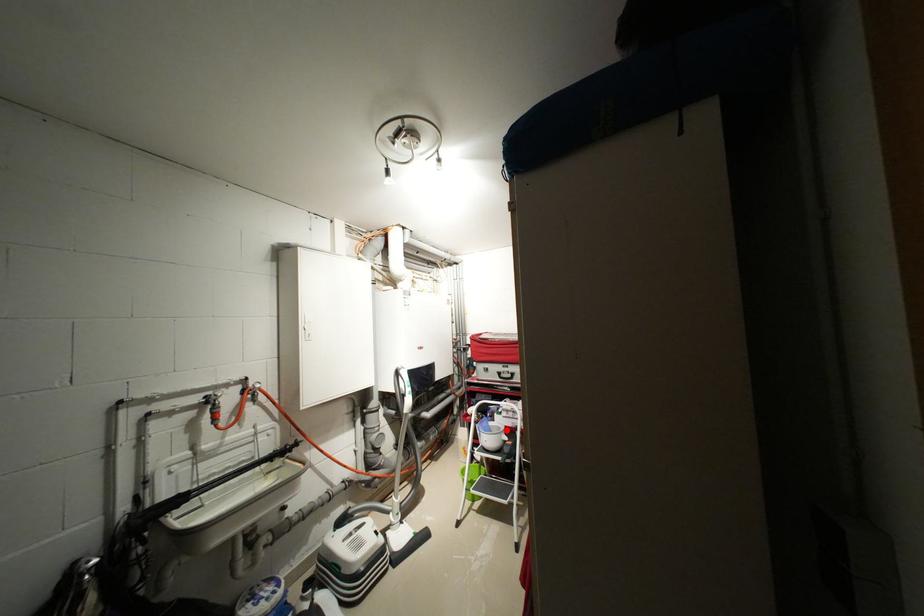
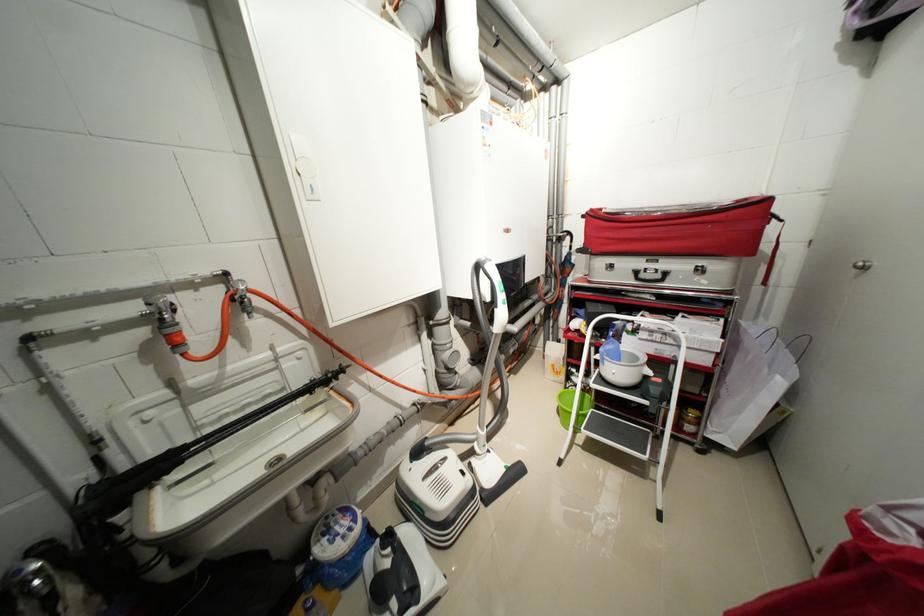
Question: I am providing you with two images of the same scene from different viewpoints. A red point is shown in image1. For the corresponding object point in image2, is it positioned nearer or farther from the camera?

Choices:
 (A) Nearer
 (B) Farther

Answer: (A)